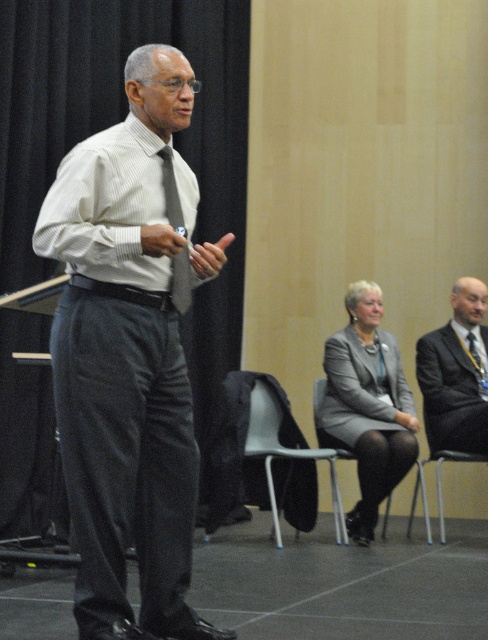
Is point (89, 436) closer to camera compared to point (248, 424)?

Yes, it is.

In the scene shown: Measure the distance from matte gray shirt at center to metallic gray chair at center.

A distance of 8.94 feet exists between matte gray shirt at center and metallic gray chair at center.

Is point (158, 388) closer to camera compared to point (278, 468)?

That is True.

Find the location of a particular element. This screenshot has height=640, width=488. matte gray shirt at center is located at coordinates (126, 358).

Does white striped shirt at center appear on the right side of metallic gray chair at center?

In fact, white striped shirt at center is to the left of metallic gray chair at center.

Which is behind, point (120, 193) or point (286, 504)?

The point (286, 504) is more distant.

The width and height of the screenshot is (488, 640). Describe the element at coordinates (107, 209) in the screenshot. I see `white striped shirt at center` at that location.

The height and width of the screenshot is (640, 488). In order to click on white striped shirt at center in this screenshot , I will do `click(107, 209)`.

Who is taller, matte gray shirt at center or white striped shirt at center?

matte gray shirt at center

Is point (122, 378) positioned after point (48, 198)?

No, it is in front of (48, 198).

You are a GUI agent. You are given a task and a screenshot of the screen. Output one action in this format:
    pyautogui.click(x=<x>, y=<y>)
    Task: Click on the matte gray shirt at center
    The image size is (488, 640).
    Given the screenshot: What is the action you would take?
    pyautogui.click(x=126, y=358)